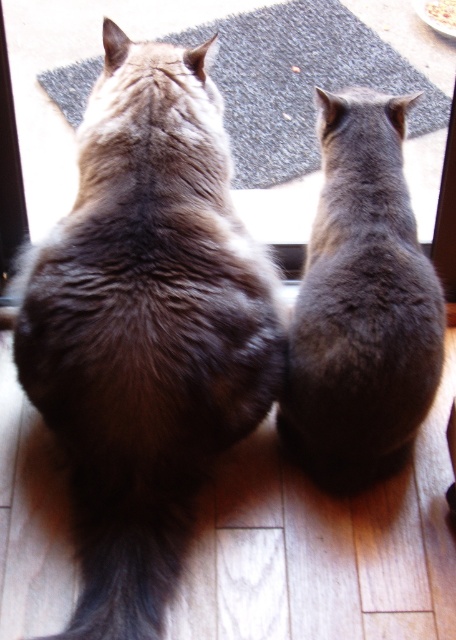
You are trying to place a small toy between the two cats sitting on the wooden floor. The gray fur cat at center is one of them. Where should you position the toy so it is exactly halfway between the two cats?

To place the toy exactly halfway between the two cats, you should position it at the midpoint between their locations. Since the gray fur cat at center is at point (362, 304), you would need to know the coordinates of the other cat to calculate the midpoint. However, the exact coordinates of the second cat aren

You are a photographer trying to capture a closeup of the brown fur cat at upper left and the white paper plate at upper center. If you want to ensure both subjects are fully visible in the frame without cropping, which subject requires a wider angle lens to accommodate its size?

The brown fur cat at upper left requires a wider angle lens because its width surpasses that of the white paper plate at upper center, so a wider angle is needed to fully capture its size without cropping.